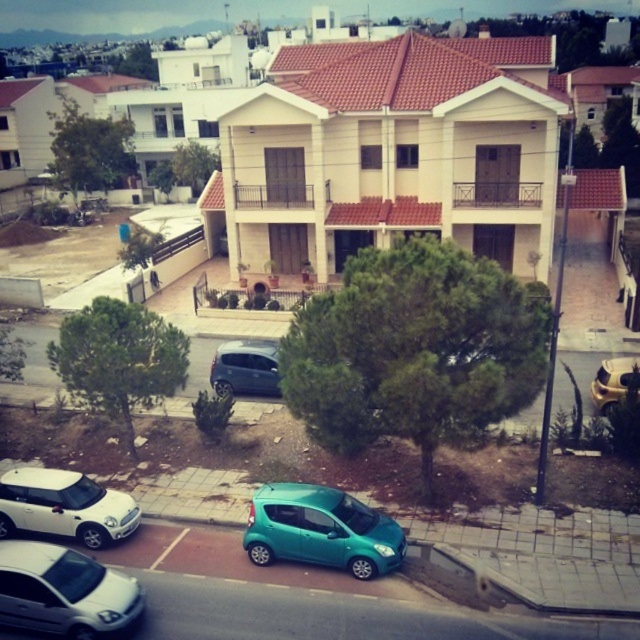
Is metallic gray hatchback at center further to camera compared to gold metallic helmet at upper right?

Yes, it is behind gold metallic helmet at upper right.

Which is in front, point (218, 356) or point (630, 376)?

Point (630, 376)

Where is `metallic gray hatchback at center`? The height and width of the screenshot is (640, 640). metallic gray hatchback at center is located at coordinates (244, 369).

I want to click on metallic gray hatchback at center, so click(244, 369).

Does white matte car at lower left lie in front of metallic gray hatchback at center?

Yes, white matte car at lower left is closer to the viewer.

Is white matte car at lower left bigger than metallic gray hatchback at center?

No.

Does point (120, 529) come behind point (237, 384)?

No, (120, 529) is in front of (237, 384).

Where is `white matte car at lower left`? The height and width of the screenshot is (640, 640). white matte car at lower left is located at coordinates click(x=65, y=506).

Which is behind, point (99, 572) or point (227, 348)?

The point (227, 348) is behind.

Find the location of a particular element. This screenshot has width=640, height=640. white glossy hatchback at lower left is located at coordinates (64, 592).

Where is `white glossy hatchback at lower left`? This screenshot has width=640, height=640. white glossy hatchback at lower left is located at coordinates (64, 592).

You are a GUI agent. You are given a task and a screenshot of the screen. Output one action in this format:
    pyautogui.click(x=<x>, y=<y>)
    Task: Click on the white glossy hatchback at lower left
    
    Given the screenshot: What is the action you would take?
    pyautogui.click(x=64, y=592)